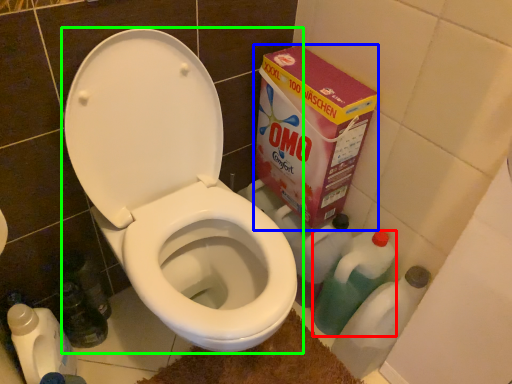
Question: Which is nearer to the cleaning product (highlighted by a red box)? cardboard box (highlighted by a blue box) or toilet (highlighted by a green box).

Choices:
 (A) cardboard box
 (B) toilet

Answer: (A)